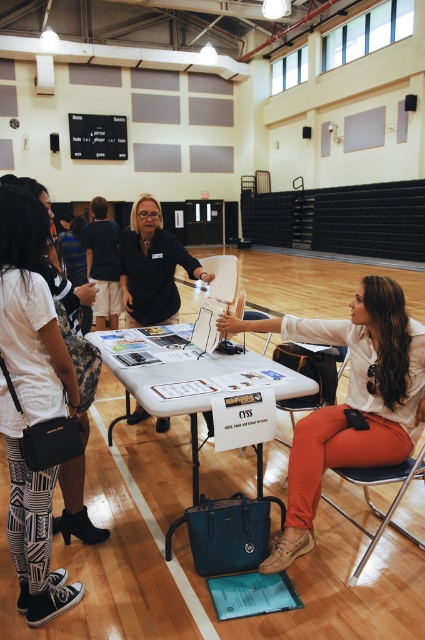
You are attending an event at a gymnasium and notice two shirts hanging from a chair. The shirts are labeled as white matte shirt at center and matte black shirt at center. Which shirt is higher up?

The white matte shirt at center is taller than the matte black shirt at center, so the white one is higher up.

You are standing at the position of point (147, 195) and want to walk to the position of point (356, 403). Which direction should you move in?

You should move forward because point (356, 403) is in front of point (147, 195).

You are a person who wants to place a small plant on the white plastic table at center. However, you notice the white matte shirt at center is already on the table. Can the plant be placed on the table without moving the shirt?

The white matte shirt at center is taller than the white plastic table at center, so placing the plant might be challenging as the shirt may block the space on the table.